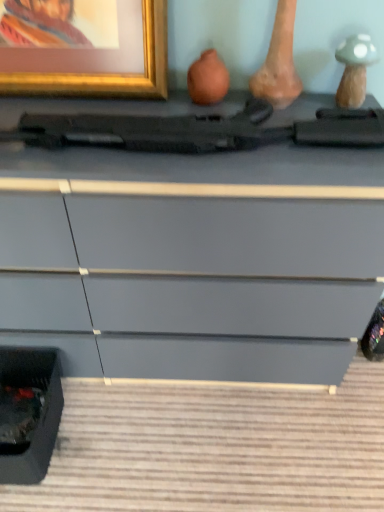
Identify the location of matte gray chest of drawers at center. (194, 257).

Measure the distance between gold metallic picture frame at upper left and camera.

gold metallic picture frame at upper left is 35.26 inches away from camera.

This screenshot has height=512, width=384. I want to click on matte gray chest of drawers at center, so click(194, 257).

Can you confirm if gold metallic picture frame at upper left is bigger than matte gray chest of drawers at center?

No.

Measure the distance between gold metallic picture frame at upper left and matte gray chest of drawers at center.

13.33 inches.

Based on the photo, is gold metallic picture frame at upper left far from matte gray chest of drawers at center?

Actually, gold metallic picture frame at upper left and matte gray chest of drawers at center are a little close together.

Does point (161, 71) appear closer or farther from the camera than point (16, 330)?

Point (161, 71) is closer to the camera than point (16, 330).

The width and height of the screenshot is (384, 512). Find the location of `equipment directly beneath the gold metallic picture frame at upper left (from a real-world perspective)`. equipment directly beneath the gold metallic picture frame at upper left (from a real-world perspective) is located at coordinates (188, 123).

Does point (90, 18) come closer to viewer compared to point (340, 120)?

No, (90, 18) is behind (340, 120).

In the scene shown: Between gold metallic picture frame at upper left and matte black gun at center, which one has larger size?

Bigger between the two is gold metallic picture frame at upper left.

From the picture: Is gold metallic picture frame at upper left at the back of matte black gun at center?

That's not correct — matte black gun at center is not looking away from gold metallic picture frame at upper left.

From a real-world perspective, is matte black gun at center under gold metallic picture frame at upper left?

Indeed, from a real-world perspective, matte black gun at center is positioned beneath gold metallic picture frame at upper left.

Is the position of matte black gun at center less distant than that of gold metallic picture frame at upper left?

Yes, matte black gun at center is in front of gold metallic picture frame at upper left.

Measure the distance between matte black gun at center and gold metallic picture frame at upper left.

They are 5.98 inches apart.

From the image's perspective, between matte black gun at center and matte gray chest of drawers at center, which one is located above?

From the image's view, matte black gun at center is above.

Can you confirm if matte black gun at center is thinner than matte gray chest of drawers at center?

Correct, the width of matte black gun at center is less than that of matte gray chest of drawers at center.

Is matte black gun at center bigger than matte gray chest of drawers at center?

No.

Does matte black gun at center lie behind matte gray chest of drawers at center?

That is True.

From the image's perspective, is matte gray chest of drawers at center over matte black gun at center?

No, from the image's perspective, matte gray chest of drawers at center is not on top of matte black gun at center.

Does point (324, 247) lie in front of point (195, 144)?

That is False.

Are matte gray chest of drawers at center and matte black gun at center making contact?

matte gray chest of drawers at center and matte black gun at center are not in contact.

Locate an element on the screen. The height and width of the screenshot is (512, 384). chest of drawers on the left of matte black gun at center is located at coordinates (194, 257).

Can you confirm if matte gray chest of drawers at center is taller than gold metallic picture frame at upper left?

Correct, matte gray chest of drawers at center is much taller as gold metallic picture frame at upper left.

In the image, there is a gold metallic picture frame at upper left. Identify the location of the chest of drawers below it (from the image's perspective). (194, 257).

In the scene shown: From the image's perspective, is matte gray chest of drawers at center beneath gold metallic picture frame at upper left?

Yes, from the image's perspective, matte gray chest of drawers at center is below gold metallic picture frame at upper left.

Is matte gray chest of drawers at center next to gold metallic picture frame at upper left and touching it?

No, matte gray chest of drawers at center is not making contact with gold metallic picture frame at upper left.

At what (x,y) coordinates should I click in order to perform the action: click on picture frame on the left of matte gray chest of drawers at center. Please return your answer as a coordinate pair (x, y). The height and width of the screenshot is (512, 384). Looking at the image, I should click on (83, 47).

I want to click on equipment in front of the gold metallic picture frame at upper left, so click(188, 123).

When comparing their distances from gold metallic picture frame at upper left, does matte gray chest of drawers at center or matte black gun at center seem further?

matte gray chest of drawers at center.

From the image, which object appears to be nearer to matte gray chest of drawers at center, matte black gun at center or gold metallic picture frame at upper left?

matte black gun at center is closer to matte gray chest of drawers at center.

Estimate the real-world distances between objects in this image. Which object is closer to gold metallic picture frame at upper left, matte black gun at center or matte gray chest of drawers at center?

matte black gun at center is closer to gold metallic picture frame at upper left.

Estimate the real-world distances between objects in this image. Which object is closer to matte black gun at center, matte gray chest of drawers at center or gold metallic picture frame at upper left?

gold metallic picture frame at upper left lies closer to matte black gun at center than the other object.

Looking at the image, which one is located closer to matte black gun at center, gold metallic picture frame at upper left or matte gray chest of drawers at center?

gold metallic picture frame at upper left lies closer to matte black gun at center than the other object.

Considering their positions, is gold metallic picture frame at upper left positioned further to matte gray chest of drawers at center than matte black gun at center?

Based on the image, gold metallic picture frame at upper left appears to be further to matte gray chest of drawers at center.

Where is `equipment between gold metallic picture frame at upper left and matte gray chest of drawers at center in the vertical direction`? This screenshot has height=512, width=384. equipment between gold metallic picture frame at upper left and matte gray chest of drawers at center in the vertical direction is located at coordinates (188, 123).